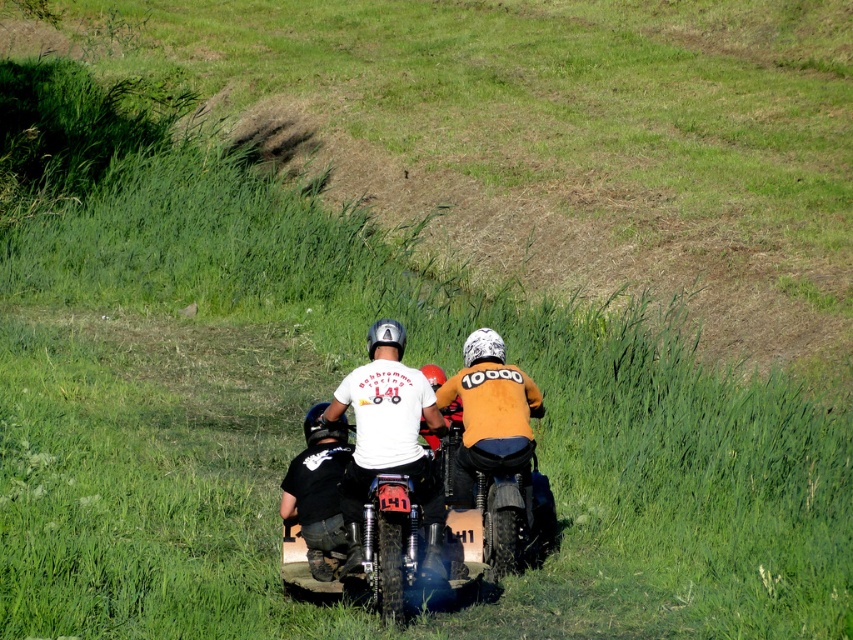
Between white matte t-shirt at center and black matte pants at center, which one is positioned lower?

black matte pants at center is lower down.

The image size is (853, 640). In order to click on white matte t-shirt at center in this screenshot , I will do 387,440.